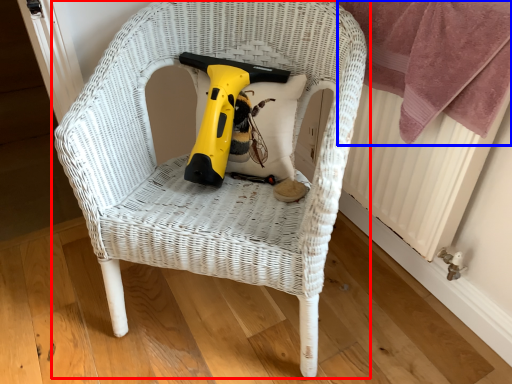
Question: Which object is further to the camera taking this photo, chair (highlighted by a red box) or blanket (highlighted by a blue box)?

Choices:
 (A) chair
 (B) blanket

Answer: (B)